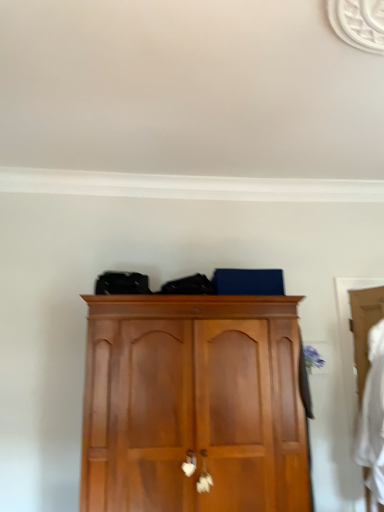
Measure the distance between point (377, 474) and camera.

The distance of point (377, 474) from camera is 9.17 feet.

What do you see at coordinates (289, 419) in the screenshot? I see `wooden wardrobe at right` at bounding box center [289, 419].

You are a GUI agent. You are given a task and a screenshot of the screen. Output one action in this format:
    pyautogui.click(x=<x>, y=<y>)
    Task: Click on the white fabric at right
    
    Given the screenshot: What is the action you would take?
    pyautogui.click(x=373, y=417)

Is the surface of wooden wardrobe at right in direct contact with wooden cupboard at center?

There is a gap between wooden wardrobe at right and wooden cupboard at center.

Identify the location of cupboard in front of the wooden wardrobe at right. The width and height of the screenshot is (384, 512). (193, 404).

Between wooden wardrobe at right and wooden cupboard at center, which one appears on the left side from the viewer's perspective?

wooden cupboard at center.

Which of these two, wooden wardrobe at right or wooden cupboard at center, is thinner?

With smaller width is wooden wardrobe at right.

Is white fabric at right not inside wooden cupboard at center?

Absolutely, white fabric at right is external to wooden cupboard at center.

Looking at this image, which object is closer to the camera taking this photo, white fabric at right or wooden cupboard at center?

wooden cupboard at center is more forward.

Is white fabric at right oriented towards wooden cupboard at center?

Yes, white fabric at right is turned towards wooden cupboard at center.

From the image's perspective, which is above, white fabric at right or wooden cupboard at center?

wooden cupboard at center is shown above in the image.

Is point (150, 399) closer or farther from the camera than point (376, 474)?

Point (150, 399) is closer to the camera than point (376, 474).

From a real-world perspective, does wooden cupboard at center stand above white fabric at right?

Yes, from a real-world perspective, wooden cupboard at center is above white fabric at right.

Is there a large distance between wooden cupboard at center and white fabric at right?

Absolutely, wooden cupboard at center is distant from white fabric at right.

Considering the relative sizes of wooden cupboard at center and white fabric at right in the image provided, is wooden cupboard at center wider than white fabric at right?

Correct, the width of wooden cupboard at center exceeds that of white fabric at right.

From a real-world perspective, between white fabric at right and wooden wardrobe at right, who is vertically lower?

white fabric at right is physically lower.

Who is taller, white fabric at right or wooden wardrobe at right?

wooden wardrobe at right.

Which of these two, white fabric at right or wooden wardrobe at right, is thinner?

With smaller width is wooden wardrobe at right.

From the image's perspective, does white fabric at right appear higher than wooden wardrobe at right?

Incorrect, from the image's perspective, white fabric at right is lower than wooden wardrobe at right.

Is wooden cupboard at center positioned far away from wooden wardrobe at right?

wooden cupboard at center is near wooden wardrobe at right, not far away.

This screenshot has width=384, height=512. Identify the location of door positioned vertically above the wooden cupboard at center (from a real-world perspective). (289, 419).

Considering the sizes of objects wooden cupboard at center and wooden wardrobe at right in the image provided, who is bigger, wooden cupboard at center or wooden wardrobe at right?

wooden cupboard at center is bigger.

Is the position of wooden cupboard at center less distant than that of wooden wardrobe at right?

Yes, wooden cupboard at center is closer to the viewer.

Considering the relative sizes of wooden wardrobe at right and white fabric at right in the image provided, is wooden wardrobe at right bigger than white fabric at right?

Incorrect, wooden wardrobe at right is not larger than white fabric at right.

Which is in front, wooden wardrobe at right or white fabric at right?

white fabric at right is in front.

Could you tell me if wooden wardrobe at right is turned towards white fabric at right?

Yes, wooden wardrobe at right faces towards white fabric at right.

From the image's perspective, is wooden wardrobe at right below white fabric at right?

Incorrect, from the image's perspective, wooden wardrobe at right is higher than white fabric at right.

Locate an element on the screen. The height and width of the screenshot is (512, 384). cupboard below the wooden wardrobe at right (from a real-world perspective) is located at coordinates (193, 404).

This screenshot has height=512, width=384. What are the coordinates of `cupboard lying above the white fabric at right (from the image's perspective)` in the screenshot? It's located at (193, 404).

Based on their spatial positions, is wooden cupboard at center or white fabric at right closer to wooden wardrobe at right?

wooden cupboard at center lies closer to wooden wardrobe at right than the other object.

Considering their positions, is white fabric at right positioned closer to wooden cupboard at center than wooden wardrobe at right?

wooden wardrobe at right.

From the image, which object appears to be farther from white fabric at right, wooden cupboard at center or wooden wardrobe at right?

Based on the image, wooden cupboard at center appears to be further to white fabric at right.

Considering their positions, is wooden wardrobe at right positioned further to wooden cupboard at center than white fabric at right?

Based on the image, white fabric at right appears to be further to wooden cupboard at center.

When comparing their distances from white fabric at right, does wooden wardrobe at right or wooden cupboard at center seem further?

Among the two, wooden cupboard at center is located further to white fabric at right.

When comparing their distances from wooden wardrobe at right, does white fabric at right or wooden cupboard at center seem closer?

wooden cupboard at center lies closer to wooden wardrobe at right than the other object.

You are a GUI agent. You are given a task and a screenshot of the screen. Output one action in this format:
    pyautogui.click(x=<x>, y=<y>)
    Task: Click on the door located between wooden cupboard at center and white fabric at right in the left-right direction
    This screenshot has width=384, height=512.
    Given the screenshot: What is the action you would take?
    point(289,419)